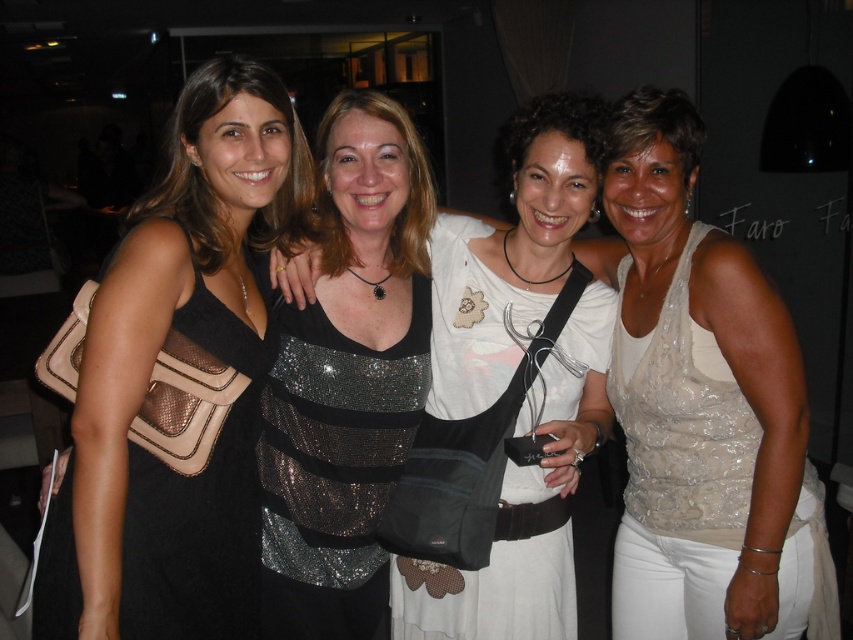
Question: Does white sequined top at center have a larger size compared to black mesh dress at left?

Choices:
 (A) no
 (B) yes

Answer: (B)

Question: Is sparkly sequined dress at center positioned at the back of white sheer dress at center?

Choices:
 (A) yes
 (B) no

Answer: (A)

Question: Which of the following is the closest to the observer?

Choices:
 (A) white sequined top at center
 (B) black mesh dress at left
 (C) white sheer dress at center

Answer: (B)

Question: Among these points, which one is nearest to the camera?

Choices:
 (A) (793, 333)
 (B) (549, 227)
 (C) (212, 579)
 (D) (283, 378)

Answer: (C)

Question: Does sparkly silver dress at center appear on the left side of black mesh dress at left?

Choices:
 (A) no
 (B) yes

Answer: (A)

Question: Which object is farther from the camera taking this photo?

Choices:
 (A) white sheer dress at center
 (B) white sequined top at center

Answer: (B)